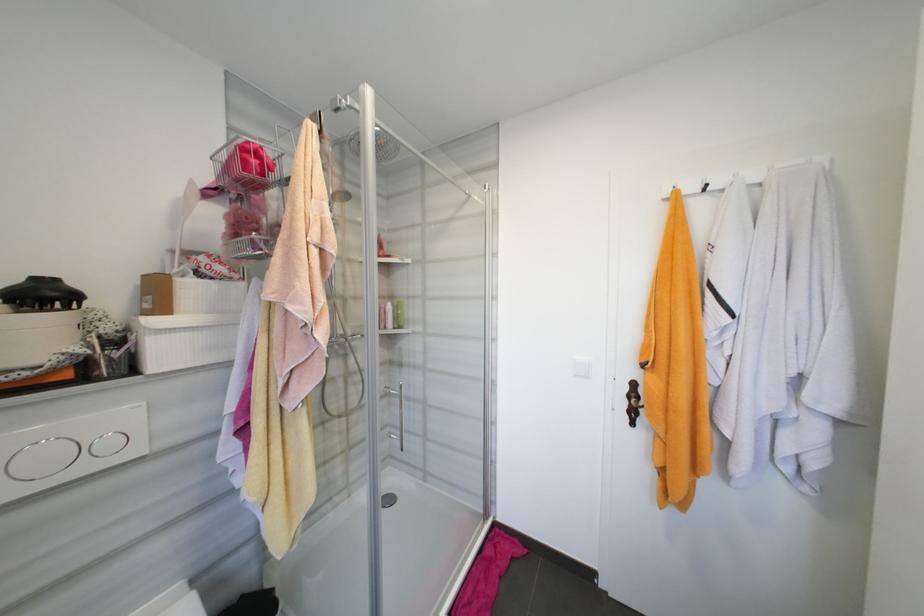
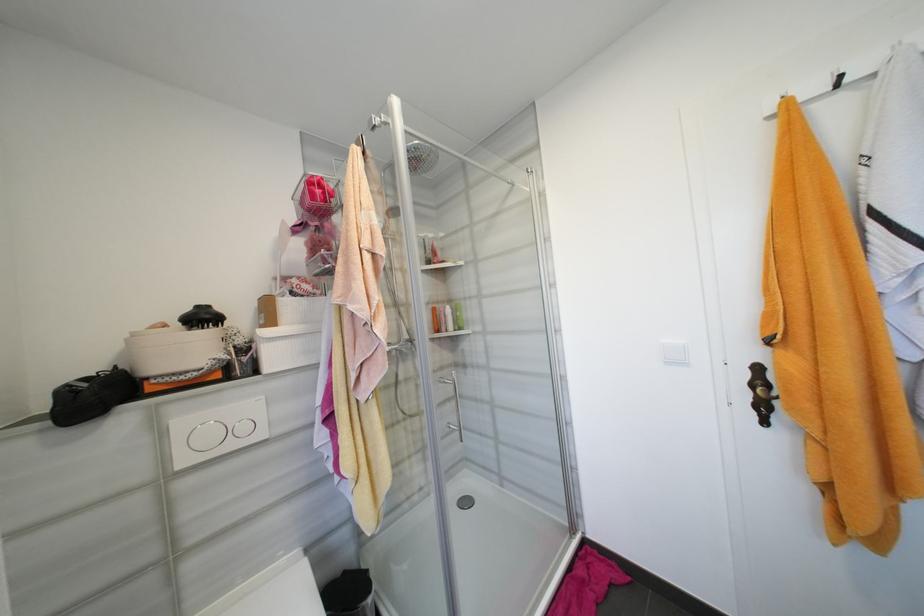
Locate, in the second image, the point that corresponds to point 398,306 in the first image.

(457, 309)